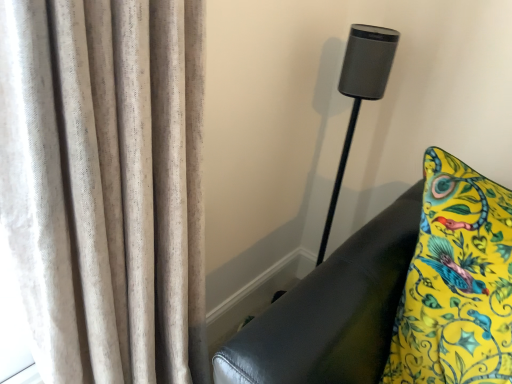
Describe the element at coordinates (398, 296) in the screenshot. This screenshot has height=384, width=512. I see `yellow fabric cushion at upper right` at that location.

Locate an element on the screen. The width and height of the screenshot is (512, 384). yellow fabric cushion at upper right is located at coordinates (398, 296).

Image resolution: width=512 pixels, height=384 pixels. I want to click on yellow fabric cushion at upper right, so click(398, 296).